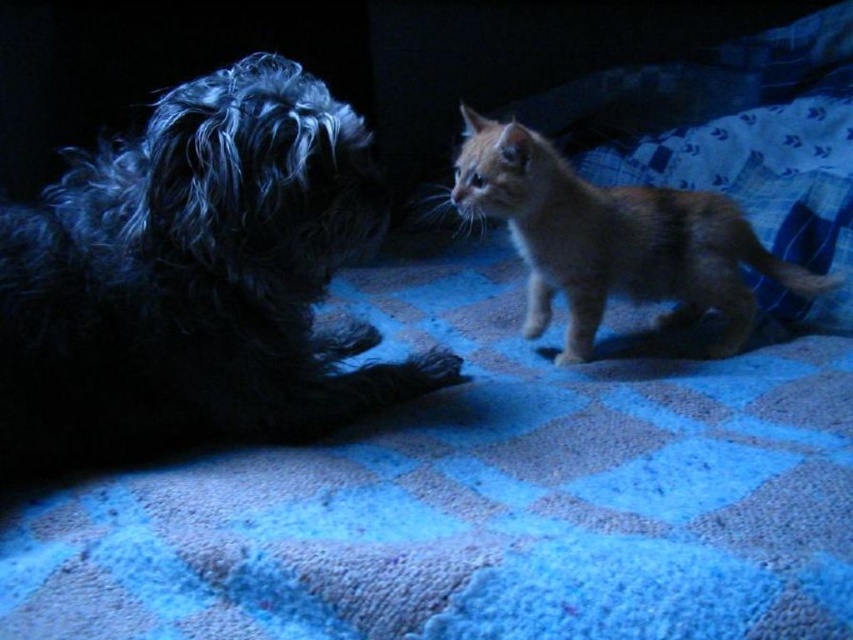
Question: Which point is farther from the camera taking this photo?

Choices:
 (A) (769, 275)
 (B) (32, 323)

Answer: (A)

Question: Among these points, which one is farthest from the camera?

Choices:
 (A) (36, 253)
 (B) (564, 240)

Answer: (B)

Question: Does shaggy black dog at left have a lesser width compared to orange fur cat at center?

Choices:
 (A) yes
 (B) no

Answer: (A)

Question: Considering the relative positions of shaggy black dog at left and orange fur cat at center in the image provided, where is shaggy black dog at left located with respect to orange fur cat at center?

Choices:
 (A) below
 (B) above

Answer: (B)

Question: Is shaggy black dog at left wider than orange fur cat at center?

Choices:
 (A) yes
 (B) no

Answer: (B)

Question: Which point is closer to the camera taking this photo?

Choices:
 (A) (480, 195)
 (B) (213, 240)

Answer: (B)